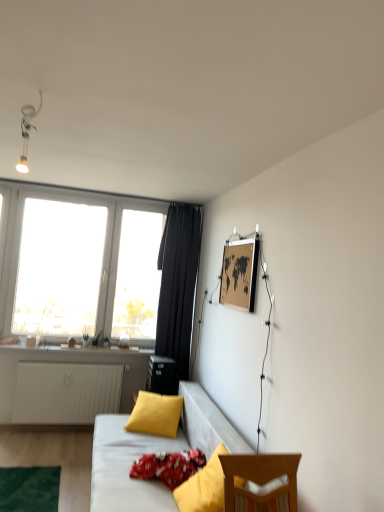
Question: Does transparent glass window at upper left have a lesser height compared to black fabric curtain at center?

Choices:
 (A) no
 (B) yes

Answer: (B)

Question: Can you confirm if transparent glass window at upper left is smaller than black fabric curtain at center?

Choices:
 (A) no
 (B) yes

Answer: (A)

Question: From a real-world perspective, is transparent glass window at upper left below black fabric curtain at center?

Choices:
 (A) yes
 (B) no

Answer: (B)

Question: From the image's perspective, would you say transparent glass window at upper left is shown under black fabric curtain at center?

Choices:
 (A) no
 (B) yes

Answer: (A)

Question: From the image's perspective, does transparent glass window at upper left appear higher than black fabric curtain at center?

Choices:
 (A) no
 (B) yes

Answer: (B)

Question: Is transparent glass window at upper left positioned with its back to black fabric curtain at center?

Choices:
 (A) no
 (B) yes

Answer: (A)

Question: Is wooden map at upper right not within red cotton pillow at lower center, marked as the second pillow in a front-to-back arrangement?

Choices:
 (A) yes
 (B) no

Answer: (A)

Question: Considering the relative positions of wooden map at upper right and red cotton pillow at lower center, arranged as the second pillow when viewed from the back, in the image provided, is wooden map at upper right to the left of red cotton pillow at lower center, arranged as the second pillow when viewed from the back, from the viewer's perspective?

Choices:
 (A) no
 (B) yes

Answer: (A)

Question: Can you confirm if wooden map at upper right is shorter than red cotton pillow at lower center, arranged as the second pillow when viewed from the back?

Choices:
 (A) no
 (B) yes

Answer: (A)

Question: From the image's perspective, is wooden map at upper right beneath red cotton pillow at lower center, arranged as the second pillow when viewed from the back?

Choices:
 (A) no
 (B) yes

Answer: (A)

Question: Does wooden map at upper right have a larger size compared to red cotton pillow at lower center, marked as the second pillow in a front-to-back arrangement?

Choices:
 (A) no
 (B) yes

Answer: (A)

Question: Is red cotton pillow at lower center, marked as the second pillow in a front-to-back arrangement, inside wooden map at upper right?

Choices:
 (A) yes
 (B) no

Answer: (B)

Question: Does yellow fabric pillow at lower right, marked as the first pillow in a front-to-back arrangement, have a greater width compared to yellow matte pillow at center, the 3th pillow positioned from the front?

Choices:
 (A) yes
 (B) no

Answer: (B)